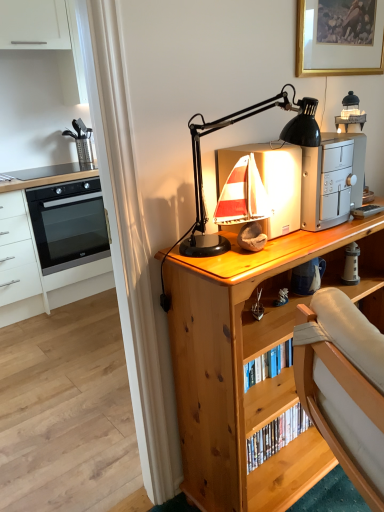
The image size is (384, 512). Identify the location of white matte cabinet at upper left. (47, 38).

Describe the element at coordinates (251, 359) in the screenshot. I see `wooden desk at center` at that location.

What is the approximate width of wooden desk at center?

It is 14.04 inches.

Measure the distance between point (39, 236) and camera.

A distance of 9.27 feet exists between point (39, 236) and camera.

Image resolution: width=384 pixels, height=512 pixels. What are the coordinates of `white ceramic lighthouse at right, placed as the 3th appliance when sorted from left to right` in the screenshot? It's located at (351, 264).

Identify the location of wooden sailboat at upper center, the first appliance when ordered from left to right. The image size is (384, 512). (270, 182).

Image resolution: width=384 pixels, height=512 pixels. Identify the location of white matte cabinet at upper left. (47, 38).

Measure the distance from white matte cabinet at upper left to white ceramic lighthouse at right, placed as the 3th appliance when sorted from left to right.

white matte cabinet at upper left and white ceramic lighthouse at right, placed as the 3th appliance when sorted from left to right, are 2.45 meters apart from each other.

Could white ceramic lighthouse at right, placed as the 3th appliance when sorted from left to right, be considered to be inside white matte cabinet at upper left?

No, white ceramic lighthouse at right, placed as the 3th appliance when sorted from left to right, is not surrounded by white matte cabinet at upper left.

Considering the sizes of objects white matte cabinet at upper left and white ceramic lighthouse at right, which is the 1th appliance from right to left, in the image provided, who is wider, white matte cabinet at upper left or white ceramic lighthouse at right, which is the 1th appliance from right to left,?

white matte cabinet at upper left.

Does white matte cabinet at upper left have a larger size compared to white ceramic lighthouse at right, placed as the 3th appliance when sorted from left to right?

Yes.

Does wooden desk at center turn towards black plastic lamp at upper center?

No.

From a real-world perspective, which is physically above, wooden desk at center or black plastic lamp at upper center?

black plastic lamp at upper center is physically above.

The width and height of the screenshot is (384, 512). I want to click on lamp positioned vertically above the wooden desk at center (from a real-world perspective), so click(x=224, y=127).

Considering the positions of points (215, 432) and (60, 73), is point (215, 432) closer to camera compared to point (60, 73)?

Yes, it is.

Is wooden desk at center to the left or to the right of white matte cabinet at upper left in the image?

From the image, it's evident that wooden desk at center is to the right of white matte cabinet at upper left.

Who is taller, wooden desk at center or white matte cabinet at upper left?

wooden desk at center.

Is wooden desk at center thinner than white matte cabinet at upper left?

Incorrect, the width of wooden desk at center is not less than that of white matte cabinet at upper left.

How much distance is there between white ceramic lighthouse at right, which is the 1th appliance from right to left, and white matte cabinet at upper left?

white ceramic lighthouse at right, which is the 1th appliance from right to left, and white matte cabinet at upper left are 2.45 meters apart.

Which of these two, white ceramic lighthouse at right, placed as the 3th appliance when sorted from left to right, or white matte cabinet at upper left, stands shorter?

With less height is white ceramic lighthouse at right, placed as the 3th appliance when sorted from left to right.

Is white ceramic lighthouse at right, placed as the 3th appliance when sorted from left to right, aimed at white matte cabinet at upper left?

No, white ceramic lighthouse at right, placed as the 3th appliance when sorted from left to right, is not aimed at white matte cabinet at upper left.

From a real-world perspective, is black plastic lamp at upper center above or below gold-framed picture at upper right?

In terms of real-world spatial position, black plastic lamp at upper center is below gold-framed picture at upper right.

Is black plastic lamp at upper center thinner than gold-framed picture at upper right?

No, black plastic lamp at upper center is not thinner than gold-framed picture at upper right.

Which of these two, black plastic lamp at upper center or white ceramic lighthouse at right, which is the 1th appliance from right to left, is wider?

black plastic lamp at upper center.

Considering the positions of points (287, 93) and (357, 279), is point (287, 93) farther from camera compared to point (357, 279)?

No, it is in front of (357, 279).

Between black plastic lamp at upper center and white ceramic lighthouse at right, which is the 1th appliance from right to left, which one appears on the left side from the viewer's perspective?

black plastic lamp at upper center.

Looking at the image, does black plastic lamp at upper center seem bigger or smaller compared to white ceramic lighthouse at right, which is the 1th appliance from right to left?

black plastic lamp at upper center is bigger than white ceramic lighthouse at right, which is the 1th appliance from right to left.

What's the angular difference between white matte cabinet at upper left and silver metallic toaster at upper right, the second appliance positioned from the left,'s facing directions?

0.806 degrees.

Based on the photo, is white matte cabinet at upper left with silver metallic toaster at upper right, marked as the second appliance in a right-to-left arrangement?

No, white matte cabinet at upper left is not touching silver metallic toaster at upper right, marked as the second appliance in a right-to-left arrangement.

Between white matte cabinet at upper left and silver metallic toaster at upper right, the second appliance positioned from the left, which one has smaller width?

silver metallic toaster at upper right, the second appliance positioned from the left, is thinner.

Considering the positions of objects white matte cabinet at upper left and silver metallic toaster at upper right, the second appliance positioned from the left, in the image provided, who is in front, white matte cabinet at upper left or silver metallic toaster at upper right, the second appliance positioned from the left,?

silver metallic toaster at upper right, the second appliance positioned from the left.

Where is `cabinetry above the white ceramic lighthouse at right, which is the 1th appliance from right to left (from a real-world perspective)`? cabinetry above the white ceramic lighthouse at right, which is the 1th appliance from right to left (from a real-world perspective) is located at coordinates (47, 38).

The height and width of the screenshot is (512, 384). In order to click on desk located behind the black plastic lamp at upper center in this screenshot , I will do `click(251, 359)`.

Based on their spatial positions, is white glossy oven at left or white matte cabinet at upper left further from white ceramic lighthouse at right, which is the 1th appliance from right to left?

white matte cabinet at upper left is positioned further to the anchor white ceramic lighthouse at right, which is the 1th appliance from right to left.

Which object lies further to the anchor point wooden sailboat at upper center, the first appliance when ordered from left to right, black plastic lamp at upper center or white ceramic lighthouse at right, placed as the 3th appliance when sorted from left to right?

white ceramic lighthouse at right, placed as the 3th appliance when sorted from left to right.

Based on their spatial positions, is silver metallic toaster at upper right, the second appliance positioned from the left, or white matte cabinet at upper left closer to wooden sailboat at upper center, the third appliance when ordered from right to left?

silver metallic toaster at upper right, the second appliance positioned from the left.

Estimate the real-world distances between objects in this image. Which object is further from white matte cabinet at upper left, silver metallic toaster at upper right, marked as the second appliance in a right-to-left arrangement, or white glossy oven at left?

silver metallic toaster at upper right, marked as the second appliance in a right-to-left arrangement, is further to white matte cabinet at upper left.

Which object lies nearer to the anchor point wooden sailboat at upper center, the third appliance when ordered from right to left, black plastic lamp at upper center or wooden desk at center?

black plastic lamp at upper center is positioned closer to the anchor wooden sailboat at upper center, the third appliance when ordered from right to left.

Estimate the real-world distances between objects in this image. Which object is further from wooden sailboat at upper center, the third appliance when ordered from right to left, gold-framed picture at upper right or white matte cabinet at upper left?

white matte cabinet at upper left is positioned further to the anchor wooden sailboat at upper center, the third appliance when ordered from right to left.

Looking at the image, which one is located closer to wooden sailboat at upper center, the third appliance when ordered from right to left, white ceramic lighthouse at right, placed as the 3th appliance when sorted from left to right, or black plastic lamp at upper center?

Based on the image, black plastic lamp at upper center appears to be nearer to wooden sailboat at upper center, the third appliance when ordered from right to left.

Estimate the real-world distances between objects in this image. Which object is further from gold-framed picture at upper right, black plastic lamp at upper center or wooden desk at center?

The object further to gold-framed picture at upper right is wooden desk at center.

Locate an element on the screen. The width and height of the screenshot is (384, 512). lamp between white glossy oven at left and white ceramic lighthouse at right, placed as the 3th appliance when sorted from left to right, in the horizontal direction is located at coordinates (224, 127).

Find the location of a particular element. Image resolution: width=384 pixels, height=512 pixels. lamp between gold-framed picture at upper right and white ceramic lighthouse at right, placed as the 3th appliance when sorted from left to right, in the up-down direction is located at coordinates (224, 127).

Where is `appliance between white glossy oven at left and silver metallic toaster at upper right, marked as the second appliance in a right-to-left arrangement, from left to right`? The height and width of the screenshot is (512, 384). appliance between white glossy oven at left and silver metallic toaster at upper right, marked as the second appliance in a right-to-left arrangement, from left to right is located at coordinates (270, 182).

Image resolution: width=384 pixels, height=512 pixels. Find the location of `home appliance situated between white glossy oven at left and silver metallic toaster at upper right, marked as the second appliance in a right-to-left arrangement, from left to right`. home appliance situated between white glossy oven at left and silver metallic toaster at upper right, marked as the second appliance in a right-to-left arrangement, from left to right is located at coordinates (68, 224).